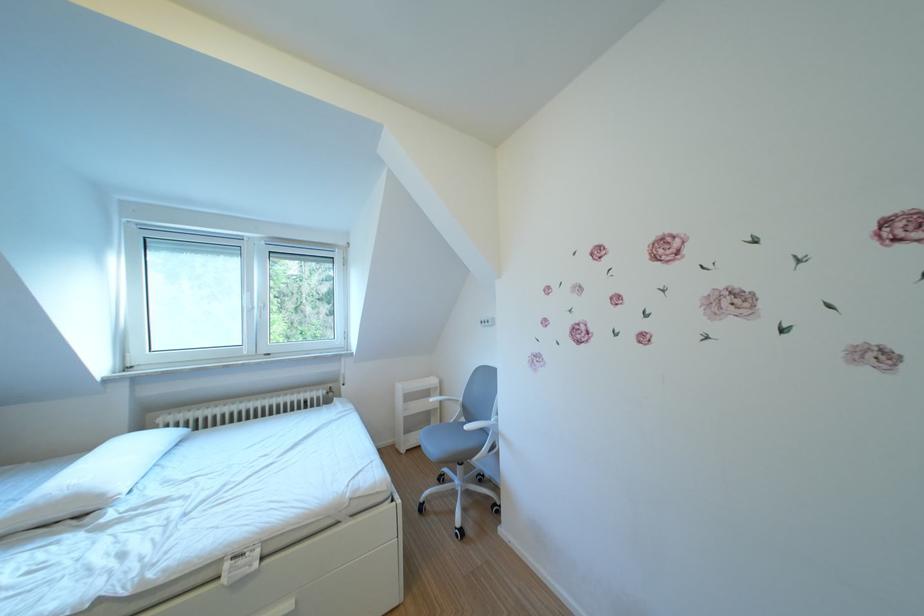
The height and width of the screenshot is (616, 924). Describe the element at coordinates (280, 608) in the screenshot. I see `the white drawer handle` at that location.